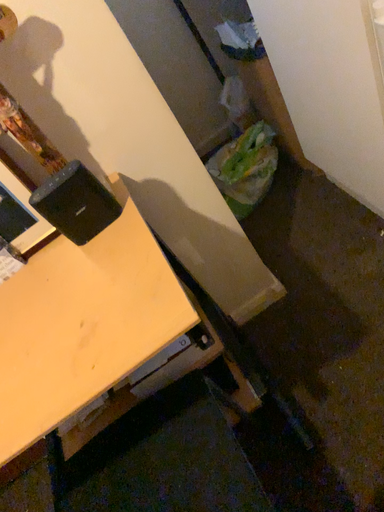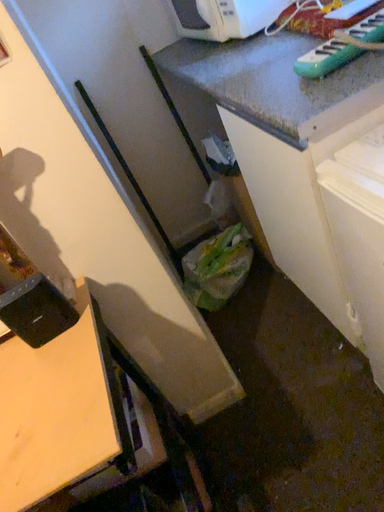
Question: How did the camera likely rotate when shooting the video?

Choices:
 (A) rotated upward
 (B) rotated downward

Answer: (A)